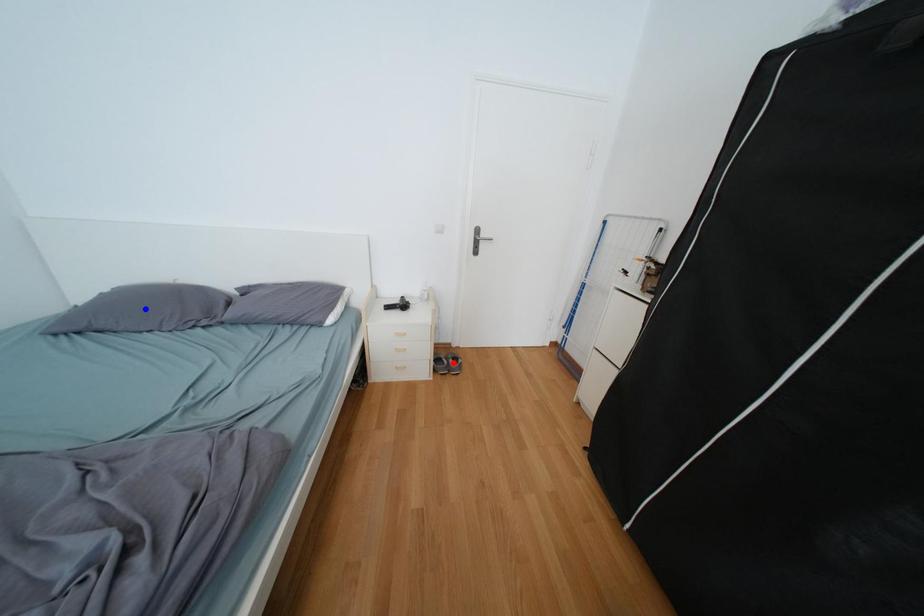
Question: Which of the two points in the image is closer to the camera?

Choices:
 (A) Blue point is closer.
 (B) Red point is closer.

Answer: (A)